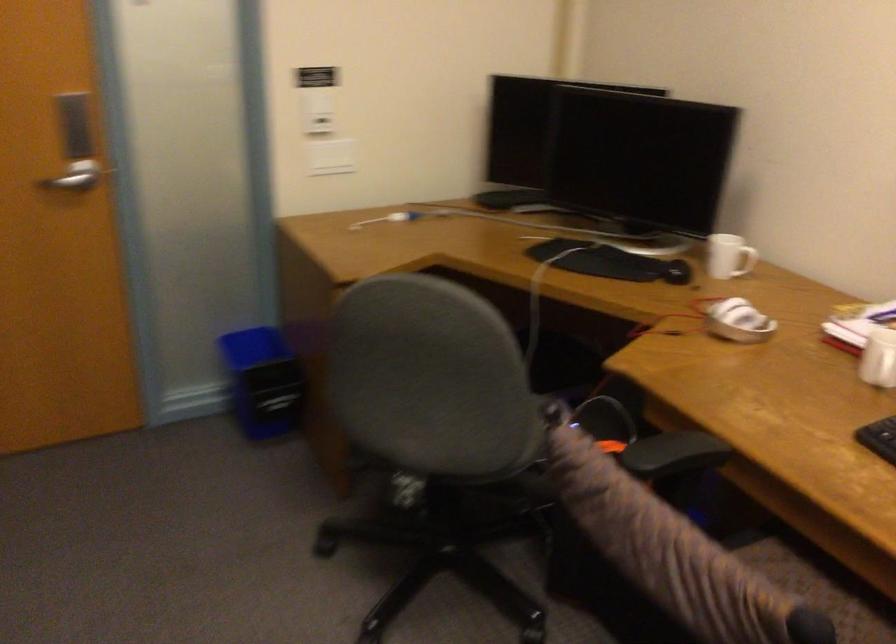
What do you see at coordinates (72, 182) in the screenshot? This screenshot has width=896, height=644. I see `a silver door handle` at bounding box center [72, 182].